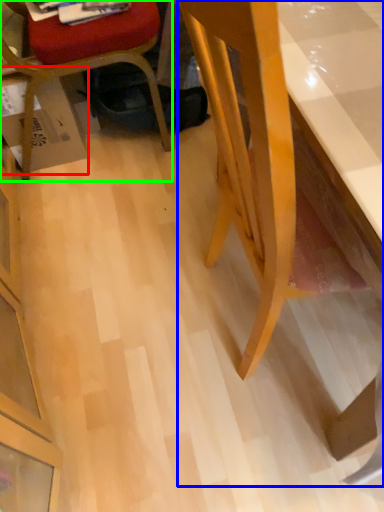
Question: Based on their relative distances, which object is farther from cardboard box (highlighted by a red box)? Choose from desk (highlighted by a blue box) and chair (highlighted by a green box).

Choices:
 (A) desk
 (B) chair

Answer: (A)